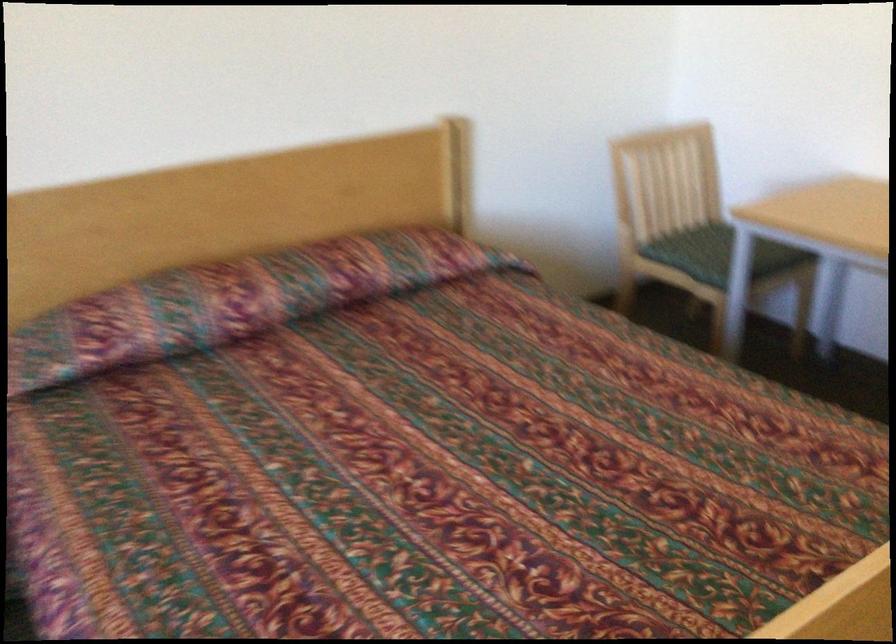
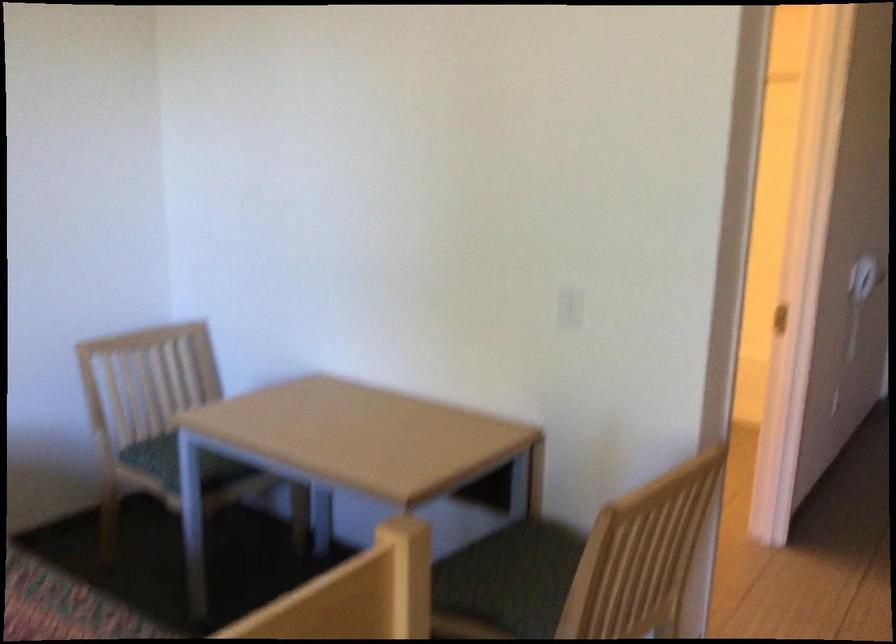
Question: The first image is from the beginning of the video and the second image is from the end. How did the camera likely rotate when shooting the video?

Choices:
 (A) Left
 (B) Right
 (C) Up
 (D) Down

Answer: (B)